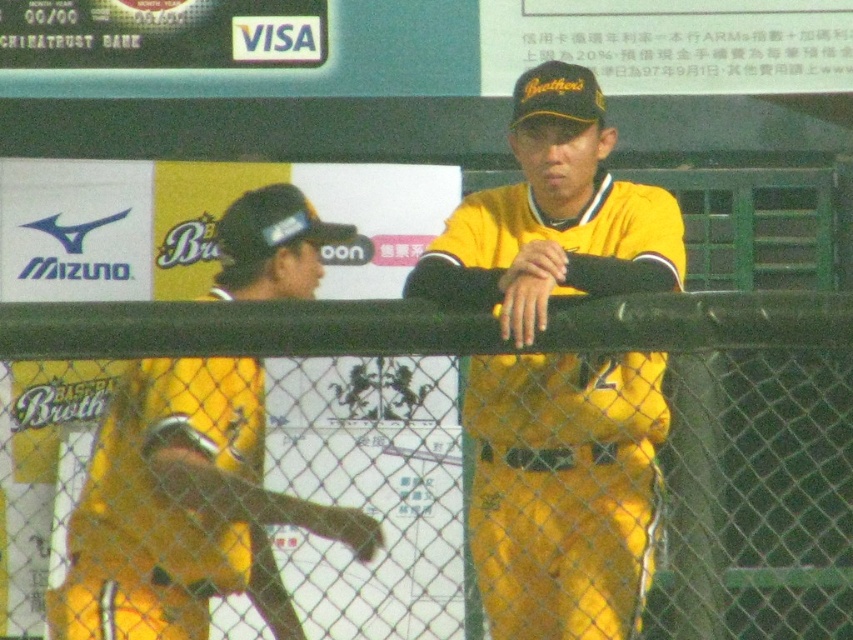
Question: Which object is closer to the camera taking this photo?

Choices:
 (A) yellow matte uniform at center
 (B) yellow matte baseball bat at left
 (C) black chain-link fence at center

Answer: (C)

Question: Which of the following is the farthest from the observer?

Choices:
 (A) (57, 595)
 (B) (618, 368)

Answer: (A)

Question: Does yellow matte baseball bat at left have a smaller size compared to black chain-link fence at center?

Choices:
 (A) no
 (B) yes

Answer: (A)

Question: Does yellow matte uniform at center have a larger size compared to black chain-link fence at center?

Choices:
 (A) no
 (B) yes

Answer: (B)

Question: Which point is closer to the camera?

Choices:
 (A) (296, 307)
 (B) (648, 481)

Answer: (A)

Question: Can you confirm if yellow matte uniform at center is positioned to the right of black chain-link fence at center?

Choices:
 (A) no
 (B) yes

Answer: (B)